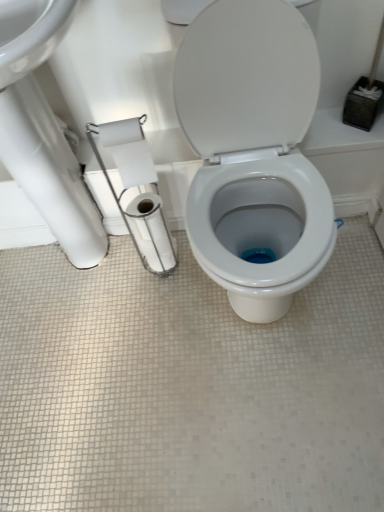
Question: From a real-world perspective, is white glossy toilet paper at center, arranged as the first toilet paper when viewed from the back, positioned under white glossy sink at upper left based on gravity?

Choices:
 (A) no
 (B) yes

Answer: (B)

Question: Is white glossy toilet paper at center, arranged as the first toilet paper when viewed from the back, aimed at white glossy sink at upper left?

Choices:
 (A) yes
 (B) no

Answer: (A)

Question: Is white glossy toilet paper at center, arranged as the first toilet paper when viewed from the back, next to white glossy sink at upper left?

Choices:
 (A) yes
 (B) no

Answer: (B)

Question: Is white glossy toilet paper at center, which ranks as the third toilet paper in front-to-back order, facing away from white glossy sink at upper left?

Choices:
 (A) yes
 (B) no

Answer: (A)

Question: Can you confirm if white glossy toilet paper at center, which ranks as the third toilet paper in front-to-back order, is wider than white glossy sink at upper left?

Choices:
 (A) yes
 (B) no

Answer: (B)

Question: Considering the positions of white paper at left, arranged as the third toilet paper when viewed from the back, and white glossy toilet at center in the image, is white paper at left, arranged as the third toilet paper when viewed from the back, bigger or smaller than white glossy toilet at center?

Choices:
 (A) small
 (B) big

Answer: (A)

Question: Looking at their shapes, would you say white paper at left, arranged as the first toilet paper when viewed from the front, is wider or thinner than white glossy toilet at center?

Choices:
 (A) wide
 (B) thin

Answer: (B)

Question: Choose the correct answer: Is white paper at left, arranged as the first toilet paper when viewed from the front, inside white glossy toilet at center or outside it?

Choices:
 (A) inside
 (B) outside

Answer: (B)

Question: In terms of height, does white paper at left, arranged as the third toilet paper when viewed from the back, look taller or shorter compared to white glossy toilet at center?

Choices:
 (A) short
 (B) tall

Answer: (A)

Question: Considering the positions of point (127, 174) and point (142, 168), is point (127, 174) closer or farther from the camera than point (142, 168)?

Choices:
 (A) closer
 (B) farther

Answer: (B)

Question: From a real-world perspective, is white paper at left, arranged as the third toilet paper when viewed from the back, physically located above or below white matte toilet paper at left, the second toilet paper in the front-to-back sequence?

Choices:
 (A) below
 (B) above

Answer: (A)

Question: Do you think white paper at left, arranged as the first toilet paper when viewed from the front, is within white matte toilet paper at left, the second toilet paper in the front-to-back sequence, or outside of it?

Choices:
 (A) outside
 (B) inside

Answer: (A)

Question: Is white paper at left, arranged as the first toilet paper when viewed from the front, taller or shorter than white matte toilet paper at left, the second toilet paper in the front-to-back sequence?

Choices:
 (A) tall
 (B) short

Answer: (A)

Question: From their relative heights in the image, would you say white matte toilet paper at left, the second toilet paper in the front-to-back sequence, is taller or shorter than white glossy toilet at center?

Choices:
 (A) tall
 (B) short

Answer: (B)

Question: From the image's perspective, relative to white glossy toilet at center, is white matte toilet paper at left, which is counted as the second toilet paper, starting from the back, above or below?

Choices:
 (A) above
 (B) below

Answer: (A)